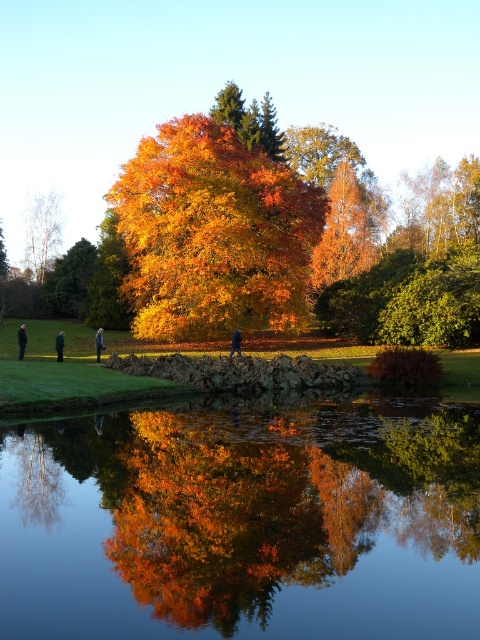
Question: Which point is closer to the camera taking this photo?

Choices:
 (A) (240, 333)
 (B) (99, 624)

Answer: (B)

Question: Estimate the real-world distances between objects in this image. Which object is closer to the black fabric person at lower left?

Choices:
 (A) glossy reflective water at center
 (B) green matte tree at upper left
 (C) white smooth birch at left

Answer: (A)

Question: Does blue fabric jacket at center appear on the right side of dark gray jacket at center?

Choices:
 (A) no
 (B) yes

Answer: (B)

Question: Does golden-orange foliage at center appear on the right side of orange autumn leaves at center?

Choices:
 (A) no
 (B) yes

Answer: (A)

Question: Is golden-orange foliage at center smaller than blue fabric jacket at center?

Choices:
 (A) no
 (B) yes

Answer: (A)

Question: Which point is farther to the camera?

Choices:
 (A) (239, 352)
 (B) (371, 244)
 (C) (52, 230)

Answer: (C)